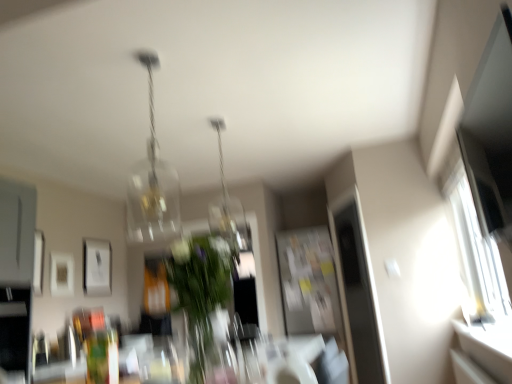
Question: Based on their sizes in the image, would you say transparent glass vase at center is bigger or smaller than matte white picture frame at left, the first picture frame from the front?

Choices:
 (A) big
 (B) small

Answer: (B)

Question: Is point (215, 344) closer or farther from the camera than point (35, 278)?

Choices:
 (A) closer
 (B) farther

Answer: (B)

Question: Estimate the real-world distances between objects in this image. Which object is farther from the clear glass pendant light at center, which ranks as the second lamp in left-to-right order?

Choices:
 (A) white glossy window sill at lower right
 (B) matte white picture frame at left, positioned as the third picture frame in back-to-front order
 (C) green leafy plant at center
 (D) transparent glass vase at center
 (E) white glossy table at center

Answer: (A)

Question: Based on their relative distances, which object is farther from the translucent glass chandelier at upper center, positioned as the 2th lamp in right-to-left order?

Choices:
 (A) green leafy plant at center
 (B) clear glass pendant light at center, positioned as the 1th lamp in back-to-front order
 (C) white matte picture frame at upper left, the 1th picture frame when ordered from back to front
 (D) white glossy table at center
 (E) white glossy window sill at lower right

Answer: (E)